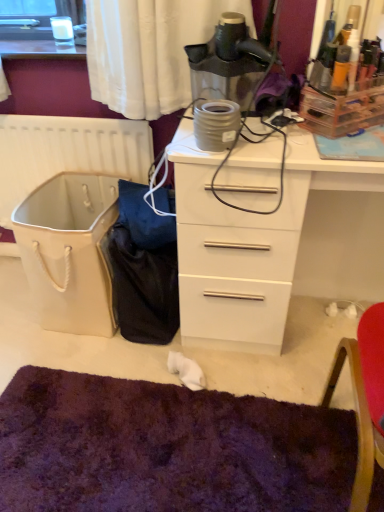
Locate an element on the screen. The width and height of the screenshot is (384, 512). vacant space situated above white plastic radiator at left (from a real-world perspective) is located at coordinates (78, 114).